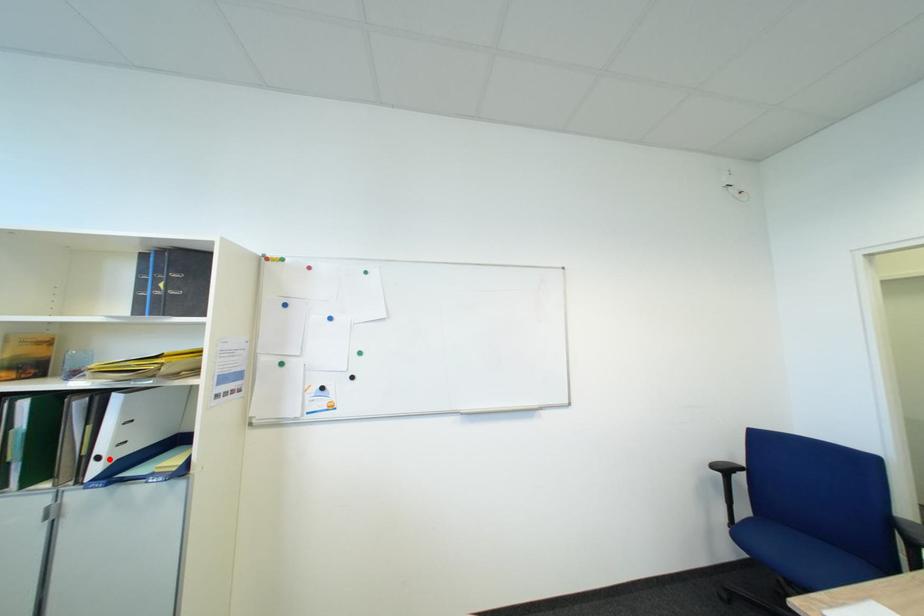
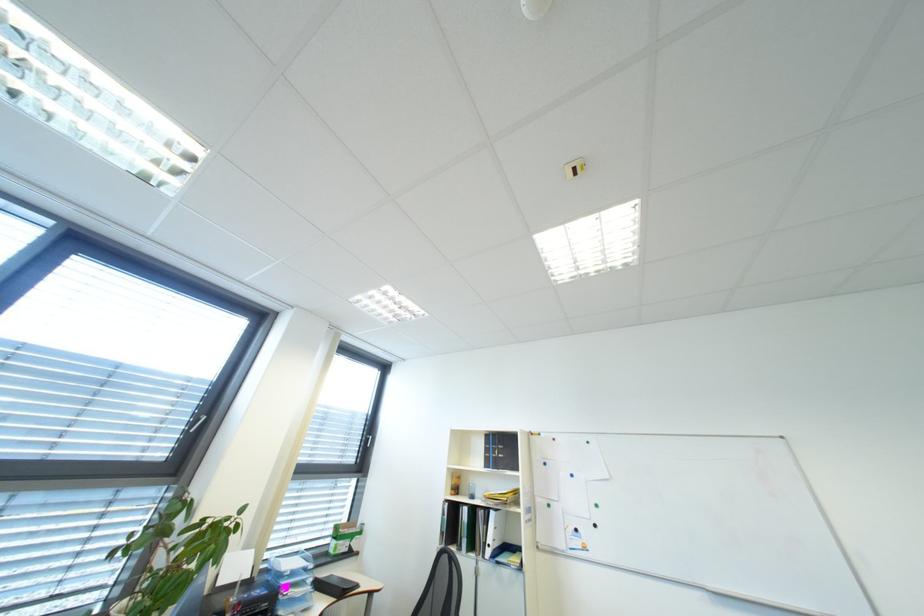
Question: I am providing you with two images of the same scene from different viewpoints. Given a red point in image1, look at the same physical point in image2. Is it:

Choices:
 (A) Closer to the viewpoint
 (B) Farther from the viewpoint

Answer: (B)